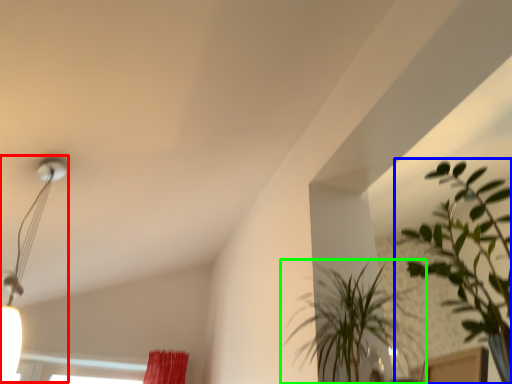
Question: Which object is positioned farthest from lamp (highlighted by a red box)? Select from houseplant (highlighted by a blue box) and houseplant (highlighted by a green box).

Choices:
 (A) houseplant
 (B) houseplant

Answer: (A)